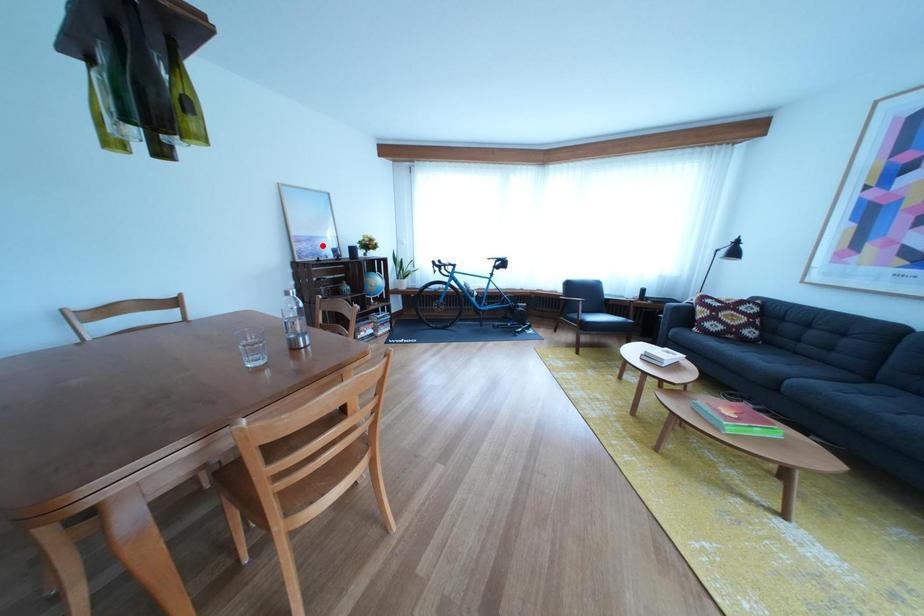
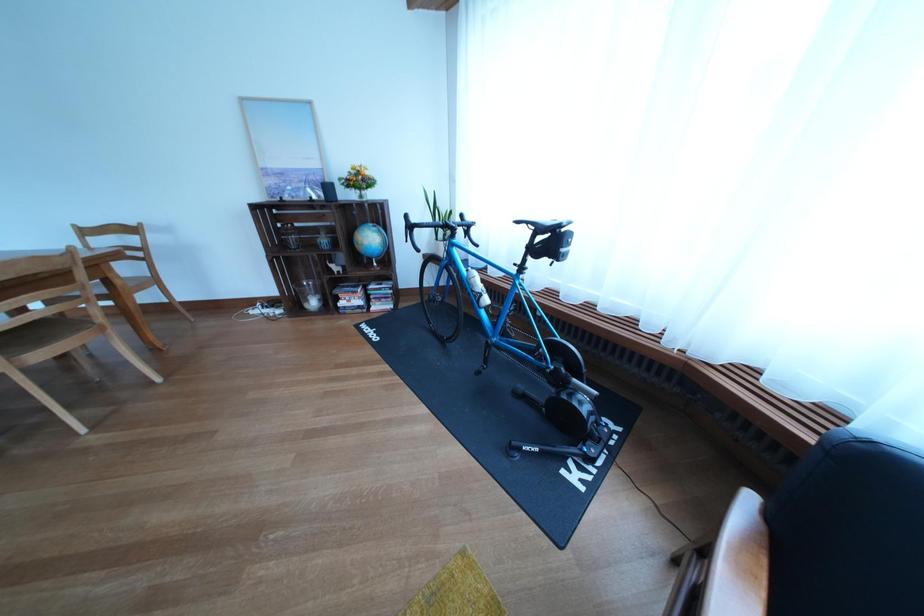
In the second image, find the point that corresponds to the highlighted location in the first image.

(294, 179)